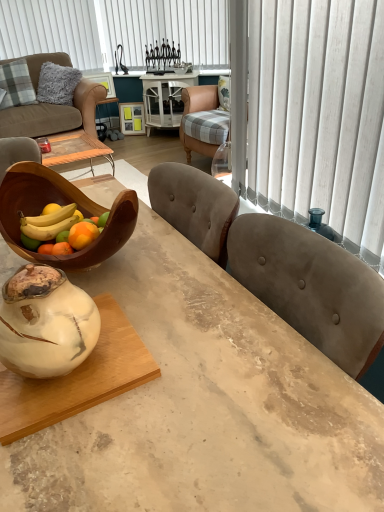
This screenshot has width=384, height=512. What are the coordinates of `spots to the right of white marble coffee table at lower left` in the screenshot? It's located at (205, 353).